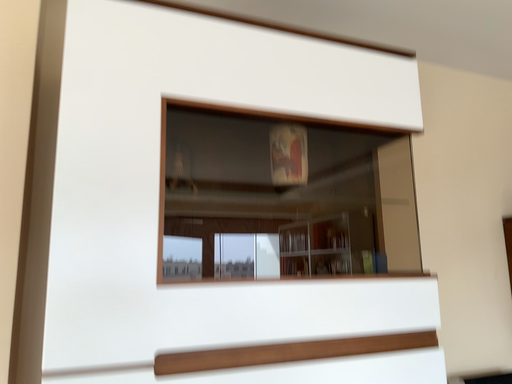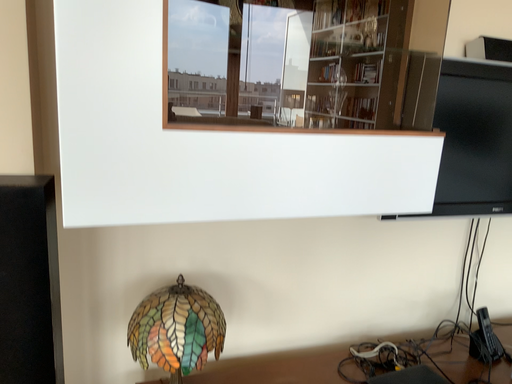
Question: Which way did the camera rotate in the video?

Choices:
 (A) rotated downward
 (B) rotated upward

Answer: (A)